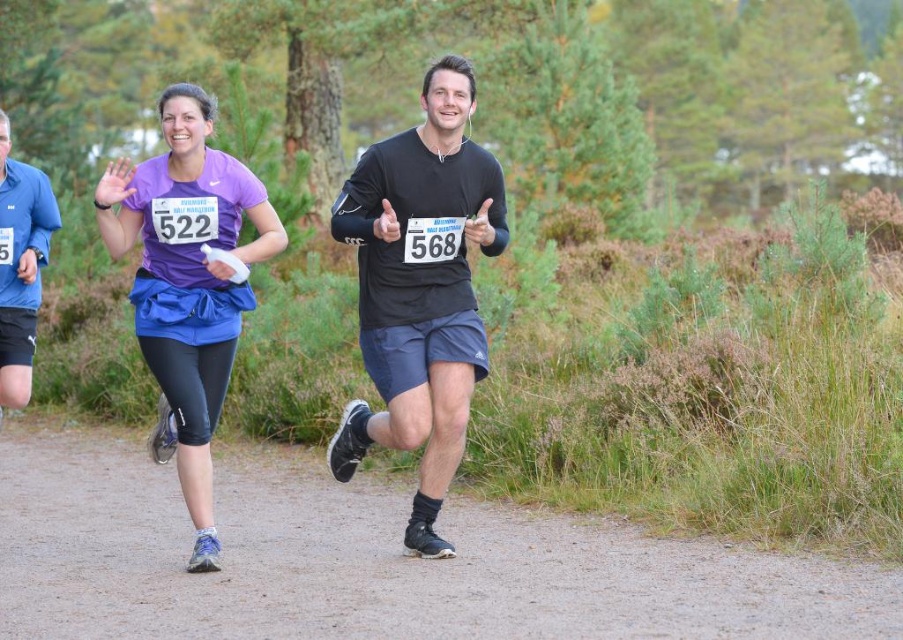
Does dirt trail at center have a lesser width compared to purple matte shirt at center?

No.

In the scene shown: Can you confirm if dirt trail at center is smaller than purple matte shirt at center?

Yes.

This screenshot has width=903, height=640. Find the location of `dirt trail at center`. dirt trail at center is located at coordinates (374, 561).

Does purple matte shirt at center appear on the right side of blue fabric shirt at left?

Yes, purple matte shirt at center is to the right of blue fabric shirt at left.

Measure the distance from purple matte shirt at center to blue fabric shirt at left.

They are 1.41 meters apart.

Is point (196, 202) positioned in front of point (12, 372)?

That is True.

Identify the location of purple matte shirt at center. This screenshot has width=903, height=640. (188, 282).

Image resolution: width=903 pixels, height=640 pixels. I want to click on black matte running shoe at center, so click(420, 289).

Describe the element at coordinates (420, 289) in the screenshot. The height and width of the screenshot is (640, 903). I see `black matte running shoe at center` at that location.

Is point (416, 426) closer to viewer compared to point (14, 177)?

Yes, point (416, 426) is in front of point (14, 177).

What are the coordinates of `black matte running shoe at center` in the screenshot? It's located at (420, 289).